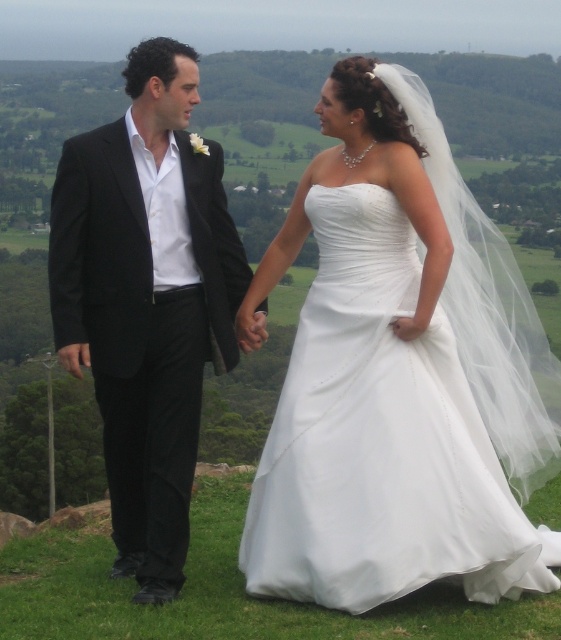
The width and height of the screenshot is (561, 640). What do you see at coordinates (379, 440) in the screenshot? I see `white satin dress at center` at bounding box center [379, 440].

Locate an element on the screen. This screenshot has height=640, width=561. white satin dress at center is located at coordinates (379, 440).